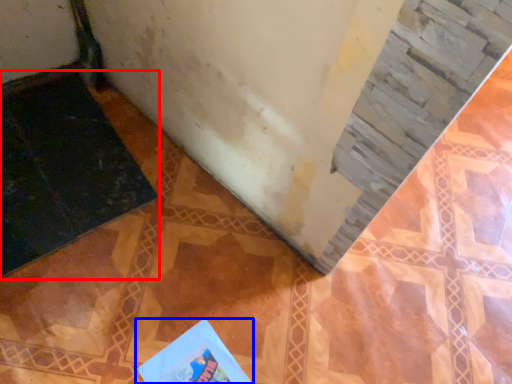
Question: Among these objects, which one is farthest to the camera, doormat (highlighted by a red box) or book (highlighted by a blue box)?

Choices:
 (A) doormat
 (B) book

Answer: (A)